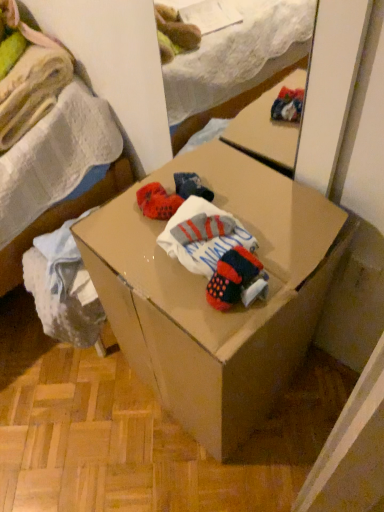
The width and height of the screenshot is (384, 512). What do you see at coordinates (205, 298) in the screenshot?
I see `cardboard box at center` at bounding box center [205, 298].

The width and height of the screenshot is (384, 512). In order to click on cardboard box at center in this screenshot , I will do `click(205, 298)`.

I want to click on cardboard box at center, so click(205, 298).